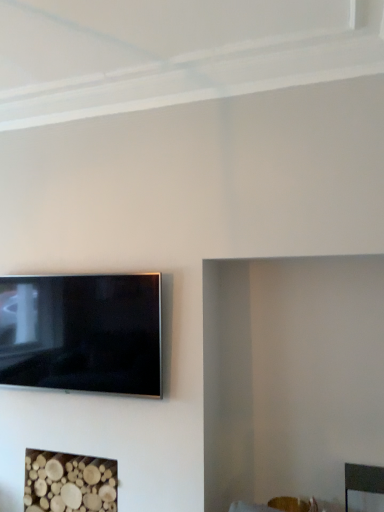
Question: Are wooden logs at lower left and matte black tv at lower left making contact?

Choices:
 (A) yes
 (B) no

Answer: (B)

Question: From a real-world perspective, is wooden logs at lower left physically above matte black tv at lower left?

Choices:
 (A) no
 (B) yes

Answer: (A)

Question: Is matte black tv at lower left located within wooden logs at lower left?

Choices:
 (A) no
 (B) yes

Answer: (A)

Question: From the image's perspective, would you say wooden logs at lower left is shown under matte black tv at lower left?

Choices:
 (A) no
 (B) yes

Answer: (B)

Question: Is wooden logs at lower left positioned with its back to matte black tv at lower left?

Choices:
 (A) no
 (B) yes

Answer: (A)

Question: Can you confirm if wooden logs at lower left is smaller than matte black tv at lower left?

Choices:
 (A) yes
 (B) no

Answer: (B)

Question: From the image's perspective, would you say matte black tv at lower left is shown under wooden logs at lower left?

Choices:
 (A) yes
 (B) no

Answer: (B)

Question: Considering the relative sizes of matte black tv at lower left and wooden logs at lower left in the image provided, is matte black tv at lower left shorter than wooden logs at lower left?

Choices:
 (A) yes
 (B) no

Answer: (B)

Question: Considering the relative sizes of matte black tv at lower left and wooden logs at lower left in the image provided, is matte black tv at lower left thinner than wooden logs at lower left?

Choices:
 (A) yes
 (B) no

Answer: (A)

Question: From the image's perspective, is matte black tv at lower left above wooden logs at lower left?

Choices:
 (A) yes
 (B) no

Answer: (A)

Question: Is matte black tv at lower left aimed at wooden logs at lower left?

Choices:
 (A) no
 (B) yes

Answer: (A)

Question: Considering the relative sizes of matte black tv at lower left and wooden logs at lower left in the image provided, is matte black tv at lower left taller than wooden logs at lower left?

Choices:
 (A) no
 (B) yes

Answer: (B)

Question: Is point (44, 342) closer or farther from the camera than point (66, 505)?

Choices:
 (A) farther
 (B) closer

Answer: (A)